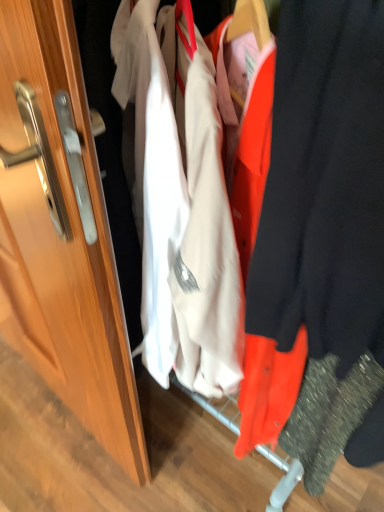
At what (x,y) coordinates should I click in order to perform the action: click on vacant space in front of wooden door at left. Please return your answer as a coordinate pair (x, y). The height and width of the screenshot is (512, 384). Looking at the image, I should click on (43, 460).